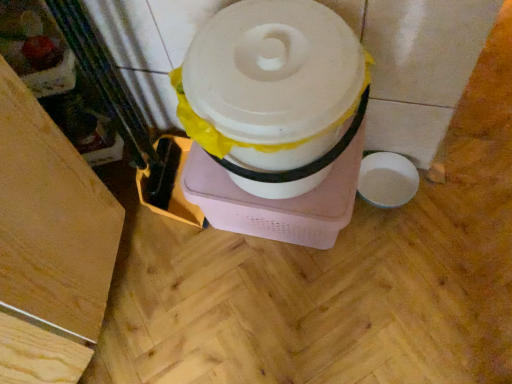
Question: Considering the relative sizes of wooden floor at lower left and white matte toilet paper at center in the image provided, is wooden floor at lower left wider than white matte toilet paper at center?

Choices:
 (A) no
 (B) yes

Answer: (B)

Question: From the image's perspective, would you say wooden floor at lower left is positioned over white matte toilet paper at center?

Choices:
 (A) no
 (B) yes

Answer: (A)

Question: Does wooden floor at lower left have a greater height compared to white matte toilet paper at center?

Choices:
 (A) no
 (B) yes

Answer: (B)

Question: Does wooden floor at lower left have a smaller size compared to white matte toilet paper at center?

Choices:
 (A) yes
 (B) no

Answer: (B)

Question: Are wooden floor at lower left and white matte toilet paper at center making contact?

Choices:
 (A) yes
 (B) no

Answer: (B)

Question: Is the position of wooden floor at lower left more distant than that of white matte toilet paper at center?

Choices:
 (A) yes
 (B) no

Answer: (B)

Question: Is white matte toilet paper at center shorter than wooden floor at lower left?

Choices:
 (A) yes
 (B) no

Answer: (A)

Question: Does white matte toilet paper at center have a lesser width compared to wooden floor at lower left?

Choices:
 (A) no
 (B) yes

Answer: (B)

Question: Considering the relative sizes of white matte toilet paper at center and wooden floor at lower left in the image provided, is white matte toilet paper at center smaller than wooden floor at lower left?

Choices:
 (A) no
 (B) yes

Answer: (B)

Question: Is the position of white matte toilet paper at center more distant than that of wooden floor at lower left?

Choices:
 (A) no
 (B) yes

Answer: (B)

Question: From the image's perspective, is white matte toilet paper at center under wooden floor at lower left?

Choices:
 (A) no
 (B) yes

Answer: (A)

Question: From the image's perspective, would you say white matte toilet paper at center is positioned over wooden floor at lower left?

Choices:
 (A) no
 (B) yes

Answer: (B)

Question: From the image's perspective, is wooden floor at lower left above or below white matte toilet paper at center?

Choices:
 (A) below
 (B) above

Answer: (A)